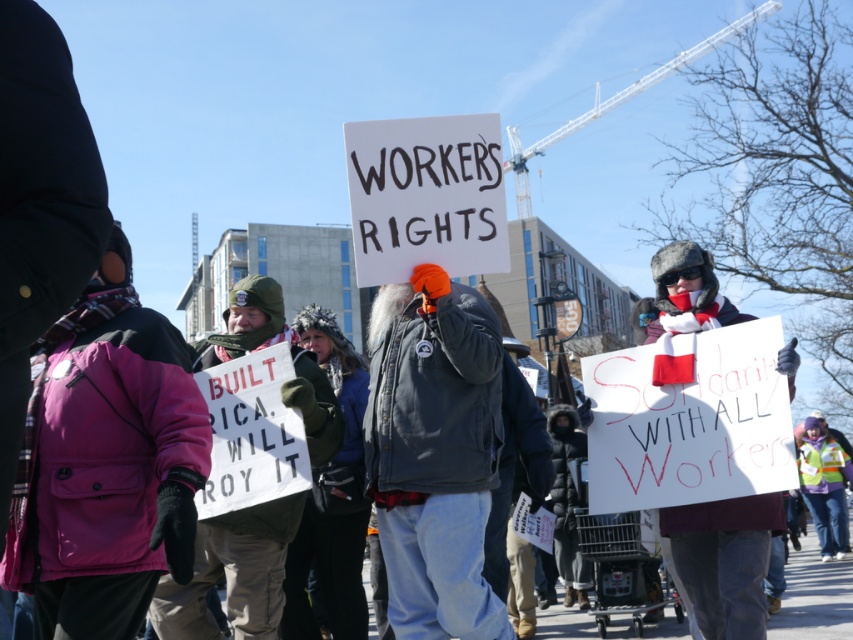
You are a photographer trying to capture the protest scene. You notice the pink fleece jacket at upper left and the white paper sign at center. Which object is positioned closer to your camera lens?

The pink fleece jacket at upper left is closer to the viewer than the white paper sign at center, so the pink fleece jacket at upper left would be closer to your camera lens.

You are standing at the origin of the coordinate system in the image. You want to move towards the point labeled point (231,584). Will you pass by the point labeled point (718,561) first?

Yes, because point (231,584) is behind point (718,561), so to reach it you must pass through point (718,561) first.

In the scene shown: You are a photographer at the protest and want to capture both the white paper sign at center and the reflective safety vest at center in a single frame. Based on their sizes, which object should you focus on to ensure both are clearly visible?

The white paper sign at center occupies less space than the reflective safety vest at center, so focusing on the reflective safety vest at center would allow both objects to be clearly visible in the frame since it takes up more space and can help anchor the composition.